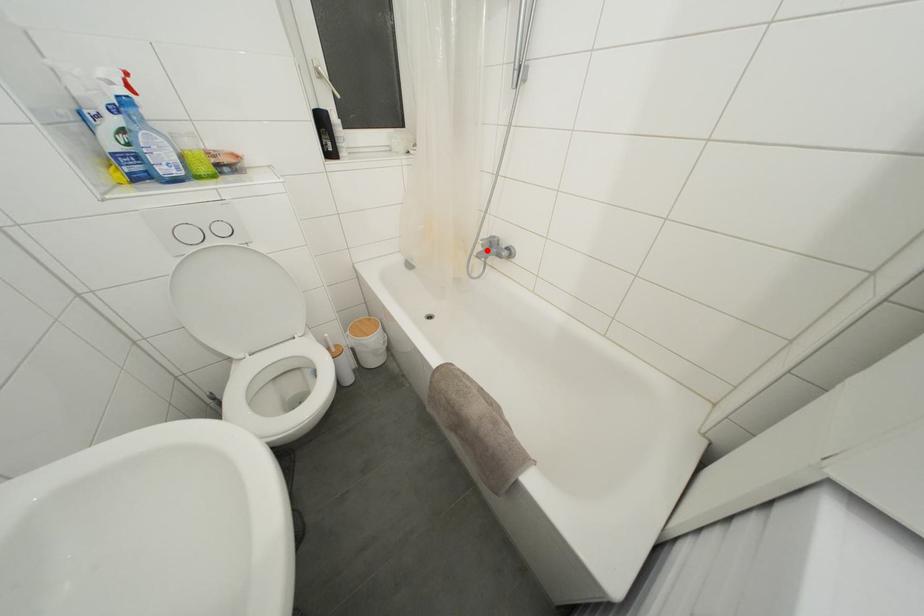
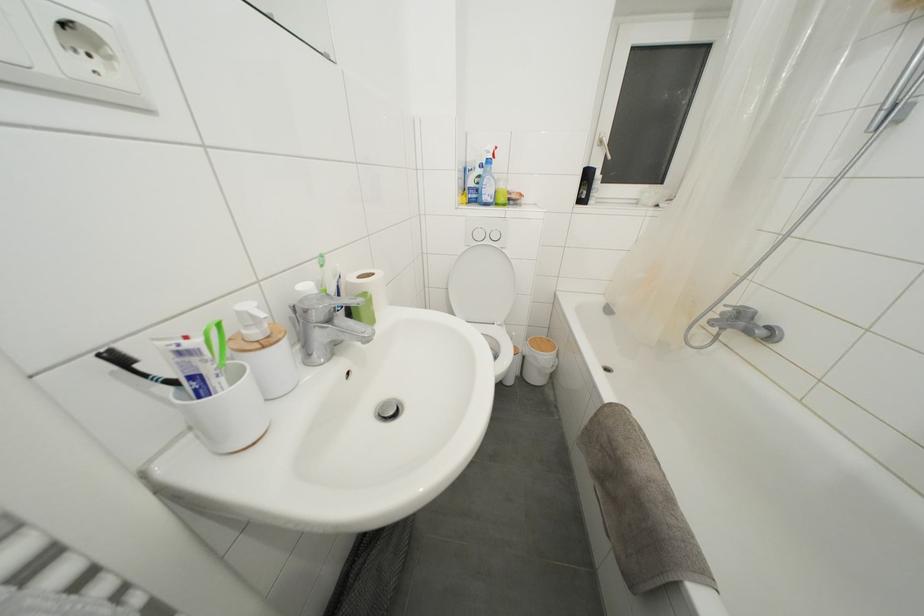
The point at the highlighted location is marked in the first image. Where is the corresponding point in the second image?

(726, 318)